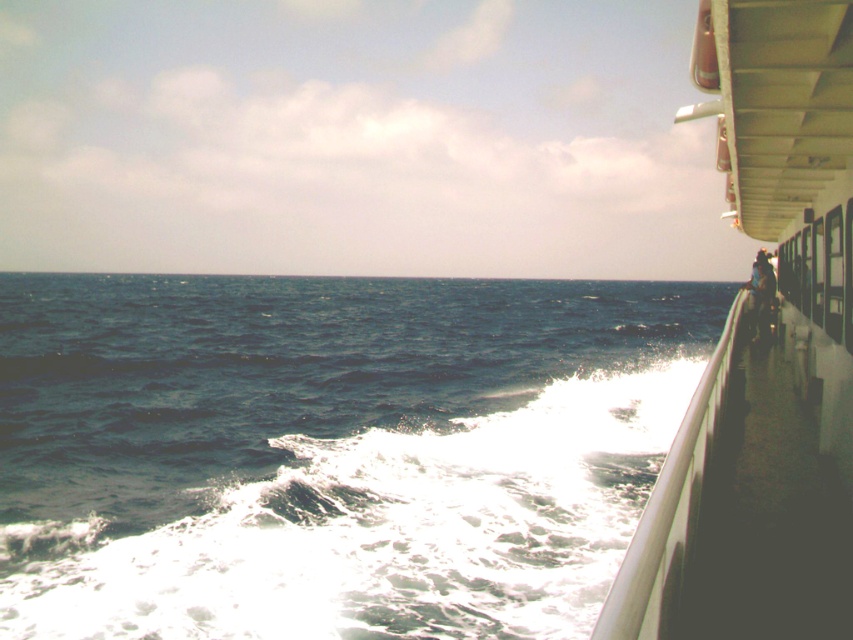
Who is higher up, blue water at lower left or brown leather jacket at right?

brown leather jacket at right is above.

Between blue water at lower left and brown leather jacket at right, which one appears on the left side from the viewer's perspective?

From the viewer's perspective, blue water at lower left appears more on the left side.

The image size is (853, 640). I want to click on blue water at lower left, so click(x=329, y=451).

Between blue water at lower left and white glossy boat at right, which one is positioned higher?

Positioned higher is white glossy boat at right.

Does blue water at lower left have a greater height compared to white glossy boat at right?

Indeed, blue water at lower left has a greater height compared to white glossy boat at right.

Does point (285, 324) lie behind point (746, 525)?

Yes, point (285, 324) is farther from viewer.

Where is `blue water at lower left`? blue water at lower left is located at coordinates (329, 451).

Does point (762, 145) lie behind point (770, 308)?

No, it is not.

Can you confirm if white glossy boat at right is wider than brown leather jacket at right?

Correct, the width of white glossy boat at right exceeds that of brown leather jacket at right.

Is point (766, 38) farther from viewer compared to point (758, 257)?

That is False.

This screenshot has height=640, width=853. Identify the location of white glossy boat at right. (763, 356).